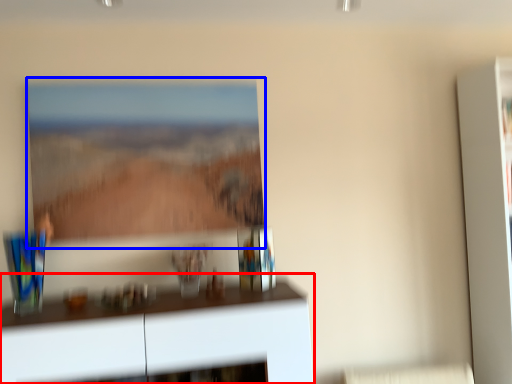
Question: Which point is closer to the camera, furniture (highlighted by a red box) or picture frame (highlighted by a blue box)?

Choices:
 (A) furniture
 (B) picture frame

Answer: (A)